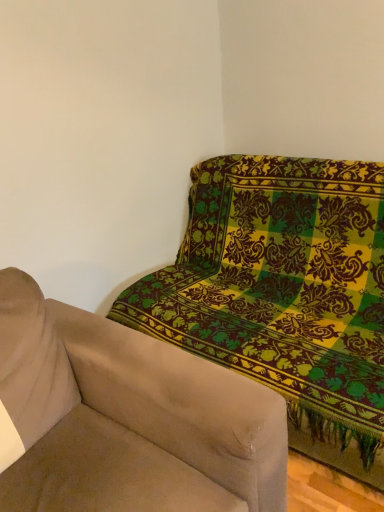
Question: From a real-world perspective, is green patterned fabric sofa at upper right positioned over beige fabric couch at upper right based on gravity?

Choices:
 (A) yes
 (B) no

Answer: (B)

Question: Is green patterned fabric sofa at upper right to the right of beige fabric couch at upper right from the viewer's perspective?

Choices:
 (A) yes
 (B) no

Answer: (A)

Question: From a real-world perspective, is green patterned fabric sofa at upper right physically below beige fabric couch at upper right?

Choices:
 (A) yes
 (B) no

Answer: (A)

Question: Is green patterned fabric sofa at upper right to the left of beige fabric couch at upper right from the viewer's perspective?

Choices:
 (A) yes
 (B) no

Answer: (B)

Question: Is green patterned fabric sofa at upper right looking in the opposite direction of beige fabric couch at upper right?

Choices:
 (A) no
 (B) yes

Answer: (A)

Question: Is the position of green patterned fabric sofa at upper right more distant than that of beige fabric couch at upper right?

Choices:
 (A) yes
 (B) no

Answer: (A)

Question: Can you confirm if beige fabric couch at upper right is smaller than green patterned fabric sofa at upper right?

Choices:
 (A) yes
 (B) no

Answer: (A)

Question: Is beige fabric couch at upper right at the left side of green patterned fabric sofa at upper right?

Choices:
 (A) yes
 (B) no

Answer: (A)

Question: Does beige fabric couch at upper right have a greater width compared to green patterned fabric sofa at upper right?

Choices:
 (A) yes
 (B) no

Answer: (B)

Question: Is beige fabric couch at upper right taller than green patterned fabric sofa at upper right?

Choices:
 (A) no
 (B) yes

Answer: (A)

Question: Is beige fabric couch at upper right with green patterned fabric sofa at upper right?

Choices:
 (A) no
 (B) yes

Answer: (A)

Question: Does beige fabric couch at upper right turn towards green patterned fabric sofa at upper right?

Choices:
 (A) no
 (B) yes

Answer: (A)

Question: In the image, is beige fabric couch at upper right positioned in front of or behind green patterned fabric sofa at upper right?

Choices:
 (A) front
 (B) behind

Answer: (A)